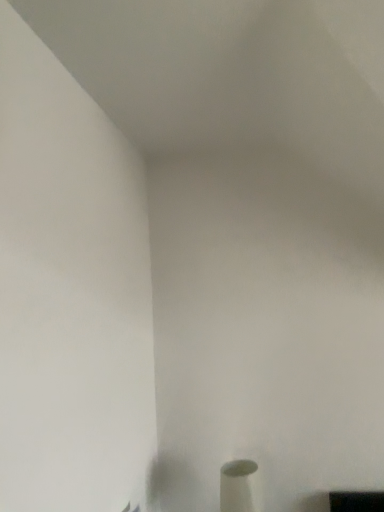
Describe the element at coordinates (240, 487) in the screenshot. I see `white glossy lampshade at bottom right` at that location.

Where is `white glossy lampshade at bottom right`? white glossy lampshade at bottom right is located at coordinates (240, 487).

Identify the location of white glossy lampshade at bottom right. This screenshot has height=512, width=384. (240, 487).